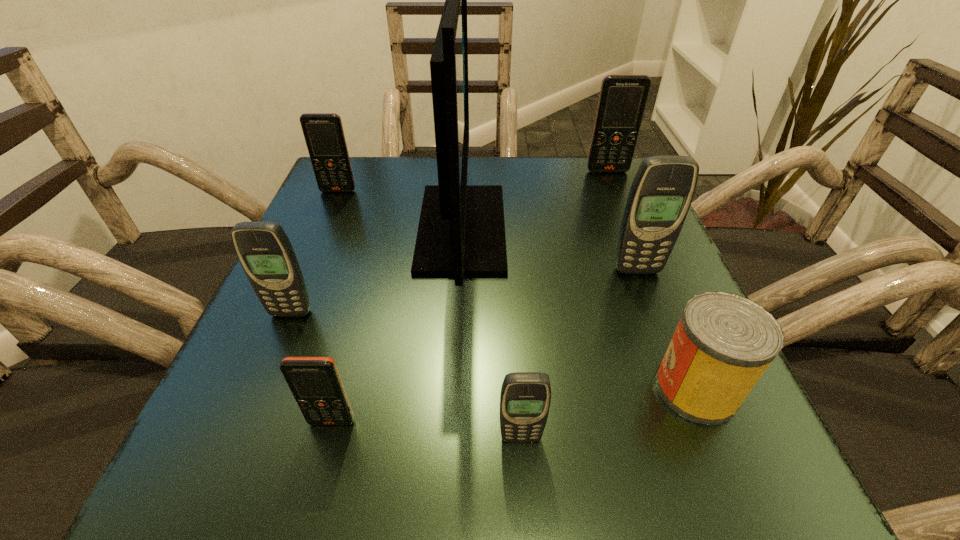
Identify the location of object that ranks as the third closest to the leftmost orange cellular telephone. The image size is (960, 540). (622, 100).

I want to click on the second closest object to the second nearest gray cellular telephone, so click(315, 383).

You are a GUI agent. You are given a task and a screenshot of the screen. Output one action in this format:
    pyautogui.click(x=<x>, y=<y>)
    Task: Click on the cellular telephone that is the second closest one to the smallest orange cellular telephone
    Image resolution: width=960 pixels, height=540 pixels.
    Given the screenshot: What is the action you would take?
    pyautogui.click(x=525, y=398)

Locate an element on the screen. The width and height of the screenshot is (960, 540). the fifth closest cellular telephone to the smallest orange cellular telephone is located at coordinates (622, 100).

The width and height of the screenshot is (960, 540). In order to click on orange cellular telephone that is the third closest to the fourth cellular telephone from left to right in this screenshot , I will do [622, 100].

Select which orange cellular telephone appears as the third closest to the second gray cellular telephone from left to right. Please provide its 2D coordinates. Your answer should be formatted as a tuple, i.e. [(x, y)], where the tuple contains the x and y coordinates of a point satisfying the conditions above.

[(622, 100)]

This screenshot has height=540, width=960. I want to click on the closest gray cellular telephone to the biggest gray cellular telephone, so click(525, 398).

Where is `the third closest gray cellular telephone to the biggest orange cellular telephone`? The image size is (960, 540). the third closest gray cellular telephone to the biggest orange cellular telephone is located at coordinates (265, 252).

Find the location of a particular element. Image resolution: width=960 pixels, height=540 pixels. free space that satisfies the following two spatial constraints: 1. on the screen of the biggest gray cellular telephone; 2. on the right side of the can is located at coordinates (683, 388).

This screenshot has width=960, height=540. I want to click on vacant space that satisfies the following two spatial constraints: 1. on the back side of the can; 2. on the screen side of the monitor, so click(x=630, y=228).